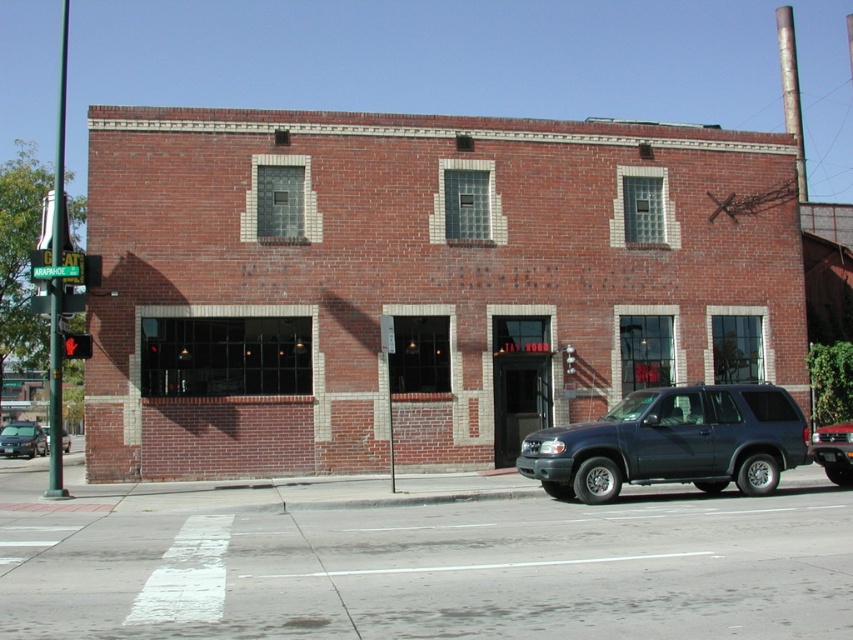
Question: Does brick building at center have a smaller size compared to metallic blue suv at center-right?

Choices:
 (A) yes
 (B) no

Answer: (B)

Question: Does metallic blue suv at center have a lesser width compared to matte black car at lower left?

Choices:
 (A) no
 (B) yes

Answer: (B)

Question: Estimate the real-world distances between objects in this image. Which object is closer to the metallic blue suv at center-right?

Choices:
 (A) brick building at center
 (B) metallic blue suv at center

Answer: (B)

Question: In this image, where is brick building at center located relative to red glass pedestrian signal at center?

Choices:
 (A) below
 (B) above

Answer: (B)

Question: Among these objects, which one is farthest from the camera?

Choices:
 (A) red glass pedestrian signal at center
 (B) matte black suv at center

Answer: (A)

Question: Which object is closer to the camera taking this photo?

Choices:
 (A) matte black suv at center
 (B) metallic blue suv at center

Answer: (B)